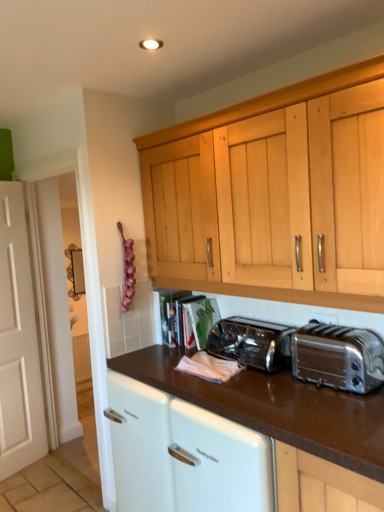
Identify the location of vacant space positioned to the left of silver metallic toaster at right, the second toaster positioned from the back. This screenshot has width=384, height=512. (283, 395).